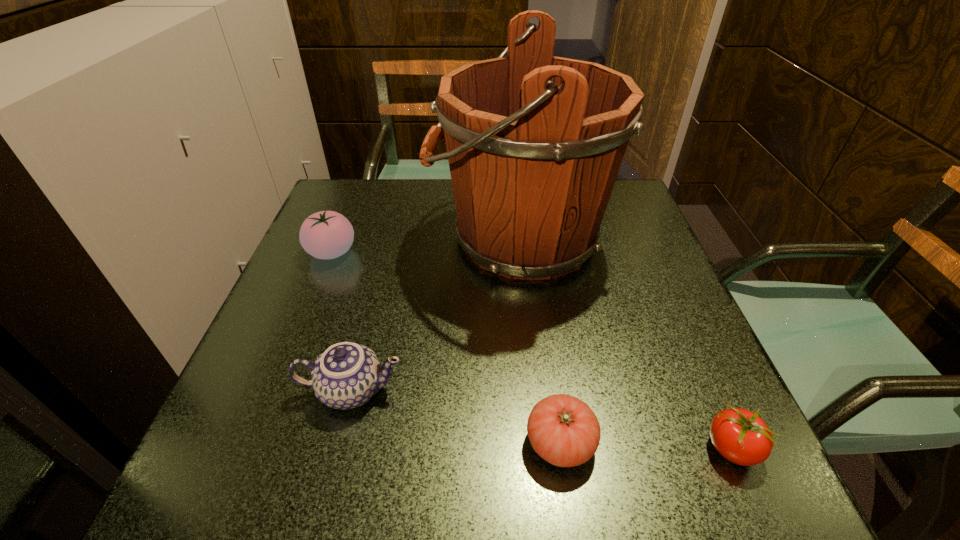
Where is `vacant space located 0.090m from the spout of the chinaware`? The image size is (960, 540). vacant space located 0.090m from the spout of the chinaware is located at coordinates (458, 390).

Image resolution: width=960 pixels, height=540 pixels. In order to click on free space located on the back of the second tomato from right to left in this screenshot , I will do `click(537, 279)`.

The width and height of the screenshot is (960, 540). Identify the location of vacant area situated 0.180m on the back of the rightmost tomato. (682, 337).

Locate an element on the screen. This screenshot has height=540, width=960. object that is positioned at the far edge is located at coordinates (535, 142).

Where is `tomato situated at the left edge`? The width and height of the screenshot is (960, 540). tomato situated at the left edge is located at coordinates (327, 234).

I want to click on chinaware present at the left edge, so click(347, 375).

Locate an element on the screen. bucket at the right edge is located at coordinates (535, 142).

Where is `tomato that is at the right edge`? This screenshot has height=540, width=960. tomato that is at the right edge is located at coordinates (739, 435).

Image resolution: width=960 pixels, height=540 pixels. I want to click on object at the far right corner, so click(x=535, y=142).

The height and width of the screenshot is (540, 960). Find the location of `object situated at the near right corner`. object situated at the near right corner is located at coordinates (739, 435).